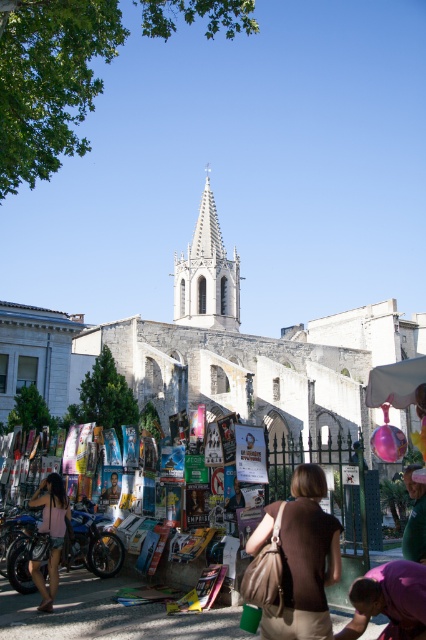
Looking at this image, you are standing in the street scene in front of the historic building. You see the white stone church at center and the matte pink dress at lower left. Which object is positioned higher in the image?

The white stone church at center is positioned higher than the matte pink dress at lower left.

You are standing in the street scene in front of the historic building. You see a brown fabric bag at center and a white stone spire at center. Which object is directly above the other?

The white stone spire at center is directly above the brown fabric bag at center because the brown fabric bag at center is positioned under it.

You are standing in front of the historic stone building and notice a brown fabric bag at center and a white stone spire at center. Which object is nearer to you?

The brown fabric bag at center is closer to the viewer than the white stone spire at center.